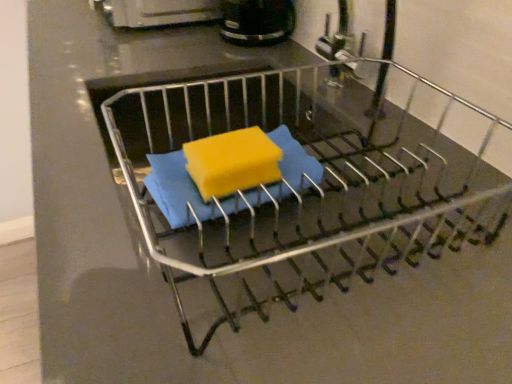
Question: Considering the relative positions of yellow sponge at center and black plastic coffee maker at upper center in the image provided, is yellow sponge at center in front of black plastic coffee maker at upper center?

Choices:
 (A) yes
 (B) no

Answer: (A)

Question: Can you confirm if yellow sponge at center is bigger than black plastic coffee maker at upper center?

Choices:
 (A) no
 (B) yes

Answer: (A)

Question: Is yellow sponge at center completely or partially outside of black plastic coffee maker at upper center?

Choices:
 (A) no
 (B) yes

Answer: (B)

Question: Is yellow sponge at center turned away from black plastic coffee maker at upper center?

Choices:
 (A) yes
 (B) no

Answer: (B)

Question: Can you confirm if yellow sponge at center is thinner than black plastic coffee maker at upper center?

Choices:
 (A) no
 (B) yes

Answer: (B)

Question: Is yellow sponge at center facing towards black plastic coffee maker at upper center?

Choices:
 (A) no
 (B) yes

Answer: (A)

Question: From a real-world perspective, is black plastic coffee maker at upper center located higher than yellow sponge at center?

Choices:
 (A) yes
 (B) no

Answer: (A)

Question: Is black plastic coffee maker at upper center outside yellow sponge at center?

Choices:
 (A) no
 (B) yes

Answer: (B)

Question: Is black plastic coffee maker at upper center behind yellow sponge at center?

Choices:
 (A) no
 (B) yes

Answer: (B)

Question: Considering the relative positions of black plastic coffee maker at upper center and yellow sponge at center in the image provided, is black plastic coffee maker at upper center to the right of yellow sponge at center from the viewer's perspective?

Choices:
 (A) yes
 (B) no

Answer: (A)

Question: Does black plastic coffee maker at upper center contain yellow sponge at center?

Choices:
 (A) yes
 (B) no

Answer: (B)

Question: Is black plastic coffee maker at upper center wider than yellow sponge at center?

Choices:
 (A) no
 (B) yes

Answer: (B)

Question: Is yellow sponge at center directly adjacent to metallic dish rack at center?

Choices:
 (A) yes
 (B) no

Answer: (B)